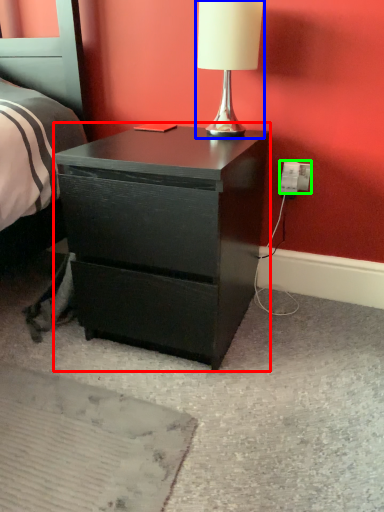
Question: Which object is positioned closest to nightstand (highlighted by a red box)? Select from table lamp (highlighted by a blue box) and electric outlet (highlighted by a green box).

Choices:
 (A) table lamp
 (B) electric outlet

Answer: (A)